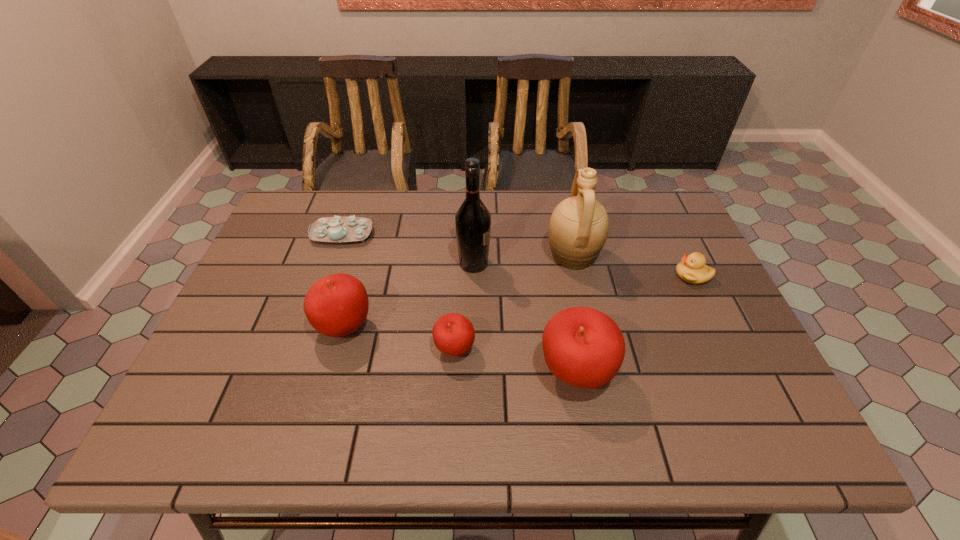
Please point out where to position a new apple on the right to maintain spacing. Please provide its 2D coordinates. Your answer should be formatted as a tuple, i.e. [(x, y)], where the tuple contains the x and y coordinates of a point satisfying the conditions above.

[(708, 401)]